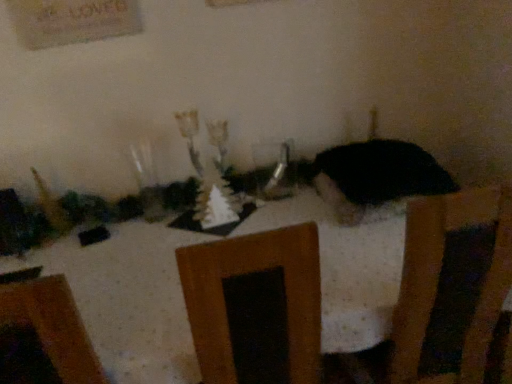
Question: Does clear glass vase at center touch black matte cat at center?

Choices:
 (A) yes
 (B) no

Answer: (B)

Question: Is clear glass vase at center shorter than black matte cat at center?

Choices:
 (A) yes
 (B) no

Answer: (B)

Question: From a real-world perspective, is clear glass vase at center below black matte cat at center?

Choices:
 (A) yes
 (B) no

Answer: (B)

Question: Is the depth of clear glass vase at center greater than that of black matte cat at center?

Choices:
 (A) yes
 (B) no

Answer: (A)

Question: From the image's perspective, does clear glass vase at center appear lower than black matte cat at center?

Choices:
 (A) no
 (B) yes

Answer: (A)

Question: Is clear glass vase at center wider than black matte cat at center?

Choices:
 (A) yes
 (B) no

Answer: (B)

Question: Is black matte cat at center at the left side of white dotted tablecloth at center?

Choices:
 (A) no
 (B) yes

Answer: (A)

Question: Are black matte cat at center and white dotted tablecloth at center located far from each other?

Choices:
 (A) no
 (B) yes

Answer: (A)

Question: Can you confirm if black matte cat at center is shorter than white dotted tablecloth at center?

Choices:
 (A) no
 (B) yes

Answer: (B)

Question: Is black matte cat at center in contact with white dotted tablecloth at center?

Choices:
 (A) yes
 (B) no

Answer: (B)

Question: From the image's perspective, is black matte cat at center on top of white dotted tablecloth at center?

Choices:
 (A) no
 (B) yes

Answer: (B)

Question: Is black matte cat at center closer to the viewer compared to white dotted tablecloth at center?

Choices:
 (A) no
 (B) yes

Answer: (A)

Question: Is black matte cat at center far from clear glass vase at center?

Choices:
 (A) yes
 (B) no

Answer: (B)